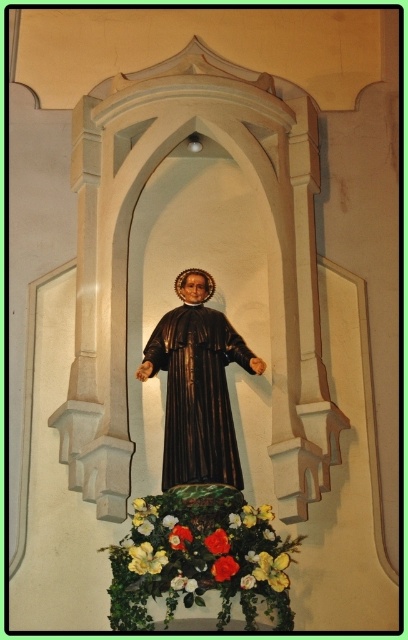
Does point (226, 556) come closer to viewer compared to point (177, 588)?

No.

Does point (232, 572) come farther from viewer compared to point (181, 579)?

That is False.

Identify the location of vivid red petals at center. (223, 566).

Is smooth glossy rose at center shorter than floral bouquet at lower center?

No, smooth glossy rose at center is not shorter than floral bouquet at lower center.

The height and width of the screenshot is (640, 408). Find the location of `smooth glossy rose at center`. smooth glossy rose at center is located at coordinates (217, 541).

Image resolution: width=408 pixels, height=640 pixels. I want to click on smooth glossy rose at center, so click(217, 541).

Is yellow fabric flower at lower center to the right of smooth glossy rose at lower center from the viewer's perspective?

Incorrect, yellow fabric flower at lower center is not on the right side of smooth glossy rose at lower center.

Which is below, yellow fabric flower at lower center or smooth glossy rose at lower center?

smooth glossy rose at lower center is below.

Who is more distant from viewer, (144, 564) or (172, 584)?

Point (144, 564)

Where is `yellow fabric flower at lower center`? yellow fabric flower at lower center is located at coordinates (146, 560).